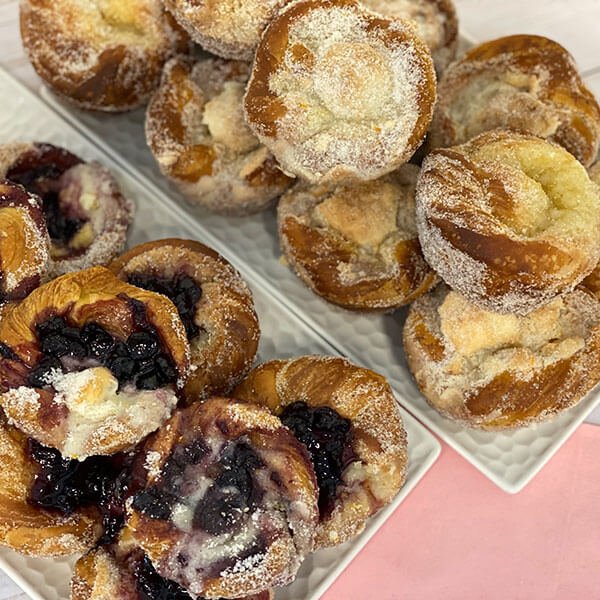
You are a GUI agent. You are given a task and a screenshot of the screen. Output one action in this format:
    pyautogui.click(x=<x>, y=<y>)
    Task: Click on the table
    This screenshot has height=600, width=600.
    Given the screenshot: What is the action you would take?
    pyautogui.click(x=12, y=593), pyautogui.click(x=591, y=414), pyautogui.click(x=585, y=21)